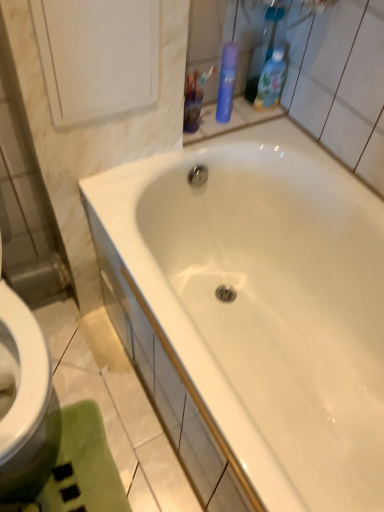
Question: Does blue matte spray can at upper right, which is the 2th cleaning product from right to left, have a larger size compared to translucent plastic cup at upper center?

Choices:
 (A) no
 (B) yes

Answer: (A)

Question: Is blue matte spray can at upper right, which is the 2th cleaning product from right to left, positioned behind translucent plastic cup at upper center?

Choices:
 (A) yes
 (B) no

Answer: (A)

Question: Is blue matte spray can at upper right, marked as the first cleaning product in a left-to-right arrangement, aimed at translucent plastic cup at upper center?

Choices:
 (A) no
 (B) yes

Answer: (A)

Question: Is blue matte spray can at upper right, which is the 2th cleaning product from right to left, next to translucent plastic cup at upper center?

Choices:
 (A) no
 (B) yes

Answer: (B)

Question: Is blue matte spray can at upper right, marked as the first cleaning product in a left-to-right arrangement, in front of translucent plastic cup at upper center?

Choices:
 (A) no
 (B) yes

Answer: (A)

Question: Is blue matte spray can at upper right, which is the 2th cleaning product from right to left, inside or outside of white glossy bathtub at center?

Choices:
 (A) outside
 (B) inside

Answer: (A)

Question: Considering their positions, is blue matte spray can at upper right, marked as the first cleaning product in a left-to-right arrangement, located in front of or behind white glossy bathtub at center?

Choices:
 (A) front
 (B) behind

Answer: (B)

Question: Looking at the image, does blue matte spray can at upper right, marked as the first cleaning product in a left-to-right arrangement, seem bigger or smaller compared to white glossy bathtub at center?

Choices:
 (A) big
 (B) small

Answer: (B)

Question: Considering the positions of blue matte spray can at upper right, which is the 2th cleaning product from right to left, and white glossy bathtub at center in the image, is blue matte spray can at upper right, which is the 2th cleaning product from right to left, taller or shorter than white glossy bathtub at center?

Choices:
 (A) short
 (B) tall

Answer: (A)

Question: Is blue matte spray can at upper right, marked as the first cleaning product in a left-to-right arrangement, to the left or to the right of white glossy medicine cabinet at upper left in the image?

Choices:
 (A) left
 (B) right

Answer: (B)

Question: Would you say blue matte spray can at upper right, marked as the first cleaning product in a left-to-right arrangement, is inside or outside white glossy medicine cabinet at upper left?

Choices:
 (A) outside
 (B) inside

Answer: (A)

Question: Relative to white glossy medicine cabinet at upper left, is blue matte spray can at upper right, which is the 2th cleaning product from right to left, in front or behind?

Choices:
 (A) front
 (B) behind

Answer: (B)

Question: Considering the positions of point (231, 89) and point (82, 109), is point (231, 89) closer or farther from the camera than point (82, 109)?

Choices:
 (A) closer
 (B) farther

Answer: (B)

Question: Is blue glossy bottle at upper right, marked as the 2th cleaning product in a left-to-right arrangement, taller or shorter than green plush bath mat at lower left?

Choices:
 (A) tall
 (B) short

Answer: (A)

Question: Is point (259, 80) positioned closer to the camera than point (39, 483)?

Choices:
 (A) farther
 (B) closer

Answer: (A)